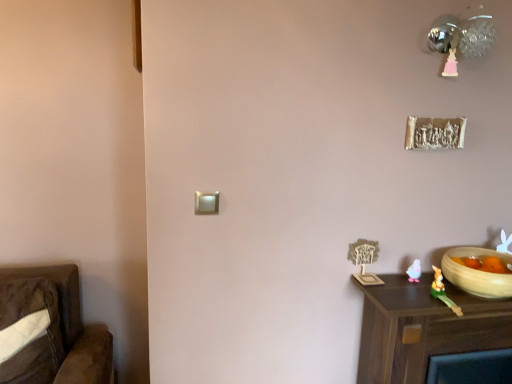
Question: Is metallic sphere at upper right taller or shorter than green rubber rabbit at lower right, arranged as the 1th toy when viewed from the front?

Choices:
 (A) short
 (B) tall

Answer: (B)

Question: From a real-world perspective, is metallic sphere at upper right above or below green rubber rabbit at lower right, arranged as the 1th toy when viewed from the front?

Choices:
 (A) below
 (B) above

Answer: (B)

Question: Estimate the real-world distances between objects in this image. Which object is farther from the pink plastic toy at lower right, the 2th toy when ordered from front to back?

Choices:
 (A) metallic sphere at upper right
 (B) green rubber rabbit at lower right, which appears as the 2th toy when viewed from the back
 (C) brown wood nightstand at lower right
 (D) beige ceramic bowl at lower right

Answer: (A)

Question: Which of these objects is positioned closest to the pink plastic toy at lower right, marked as the first toy in a back-to-front arrangement?

Choices:
 (A) beige ceramic bowl at lower right
 (B) green rubber rabbit at lower right, arranged as the 1th toy when viewed from the front
 (C) metallic sphere at upper right
 (D) brown wood nightstand at lower right

Answer: (B)